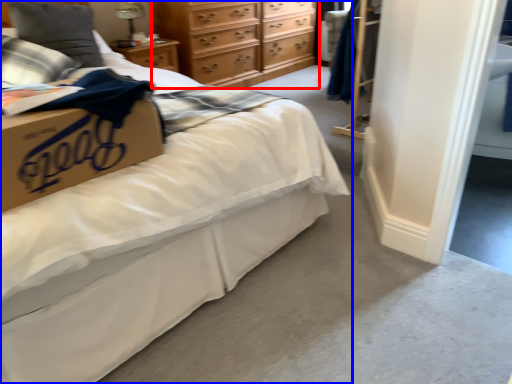
Question: Which of the following is the farthest to the observer, chest of drawers (highlighted by a red box) or bed (highlighted by a blue box)?

Choices:
 (A) chest of drawers
 (B) bed

Answer: (A)